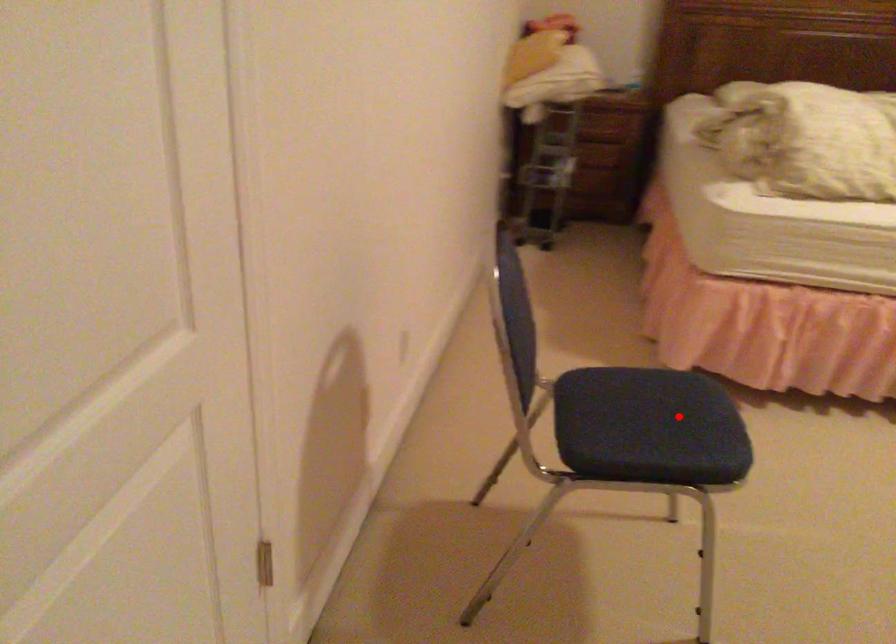
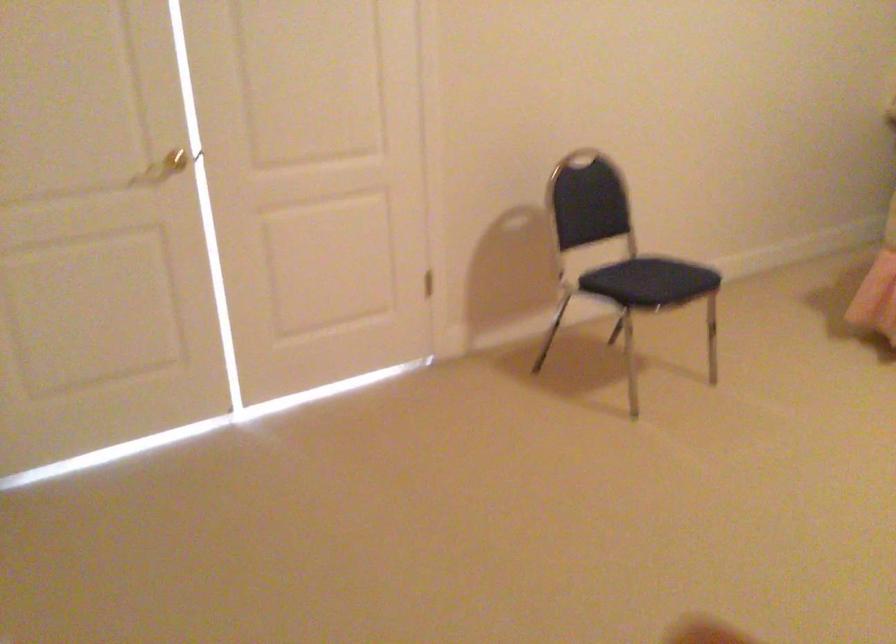
Question: I am providing you with two images of the same scene from different viewpoints. Given a red point in image1, look at the same physical point in image2. Is it:

Choices:
 (A) Closer to the viewpoint
 (B) Farther from the viewpoint

Answer: (B)